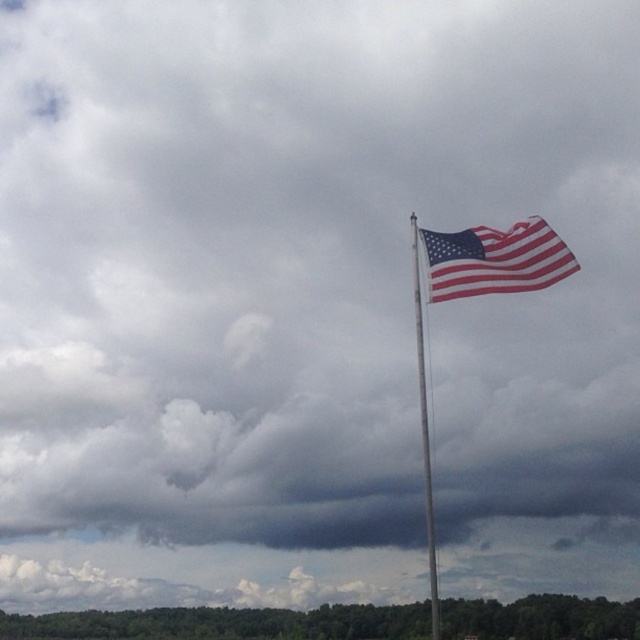
You are standing in front of the American flag pole and want to take a photo. There are two points marked on the flag, one at point coordinates point (513, 252) and another at point coordinates point (429, 506). Which point will appear larger in your photo?

Point (513, 252) is closer to the camera than point (429, 506), so it will appear larger in the photo.